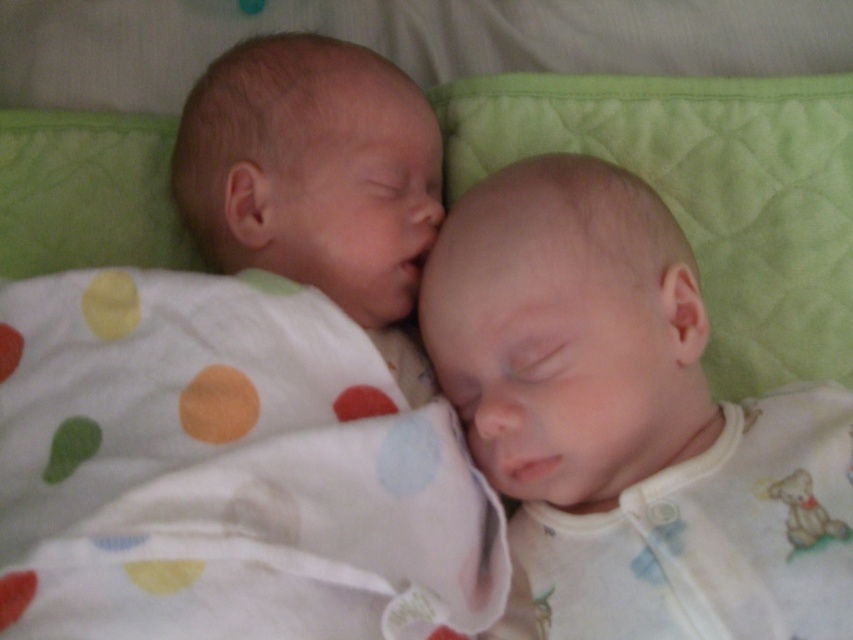
Question: Which object is farther from the camera taking this photo?

Choices:
 (A) smooth skin newborn at center
 (B) smooth white baby at center

Answer: (B)

Question: Among these points, which one is nearest to the camera?

Choices:
 (A) (173, 476)
 (B) (509, 204)

Answer: (A)

Question: Which point is closer to the camera?

Choices:
 (A) smooth white baby at center
 (B) smooth skin newborn at center

Answer: (B)

Question: Does smooth skin newborn at center have a lesser width compared to smooth white baby at center?

Choices:
 (A) no
 (B) yes

Answer: (A)

Question: Does smooth skin newborn at center have a lesser width compared to smooth white baby at center?

Choices:
 (A) yes
 (B) no

Answer: (B)

Question: Can you confirm if smooth skin newborn at center is smaller than smooth white baby at center?

Choices:
 (A) yes
 (B) no

Answer: (B)